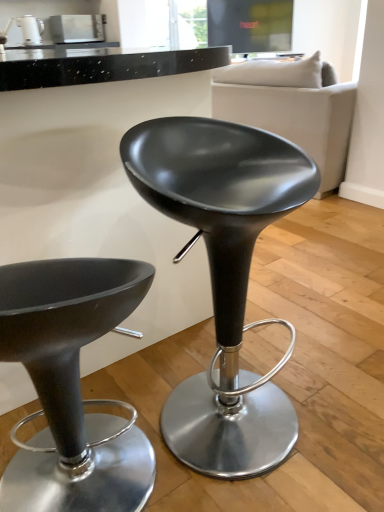
Question: In terms of height, does matte black stool at center, which is counted as the 2th chair, starting from the right, look taller or shorter compared to soft beige fabric couch at upper right?

Choices:
 (A) short
 (B) tall

Answer: (A)

Question: In terms of size, does matte black stool at center, arranged as the 1th chair when viewed from the left, appear bigger or smaller than soft beige fabric couch at upper right?

Choices:
 (A) small
 (B) big

Answer: (A)

Question: Which of these objects is positioned farthest from the soft beige fabric couch at upper right?

Choices:
 (A) matte white kettle at upper left, the first appliance viewed from the left
 (B) metallic stainless steel kettle at upper left, which ranks as the 1th appliance in right-to-left order
 (C) matte black stool at center, arranged as the 1th chair when viewed from the left
 (D) matte black stool at center, arranged as the first chair when viewed from the right

Answer: (A)

Question: Which is farther from the matte black stool at center, arranged as the 1th chair when viewed from the left?

Choices:
 (A) matte black stool at center, the second chair from the left
 (B) matte white kettle at upper left, positioned as the 2th appliance in right-to-left order
 (C) metallic stainless steel kettle at upper left, the 2th appliance in the left-to-right sequence
 (D) soft beige fabric couch at upper right

Answer: (C)